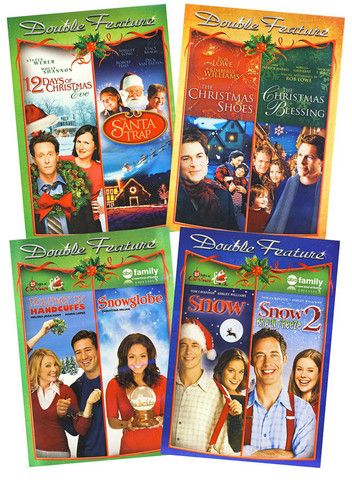
The width and height of the screenshot is (352, 480). Find the location of `dvds`. dvds is located at coordinates (82, 43), (239, 95), (230, 318), (121, 323).